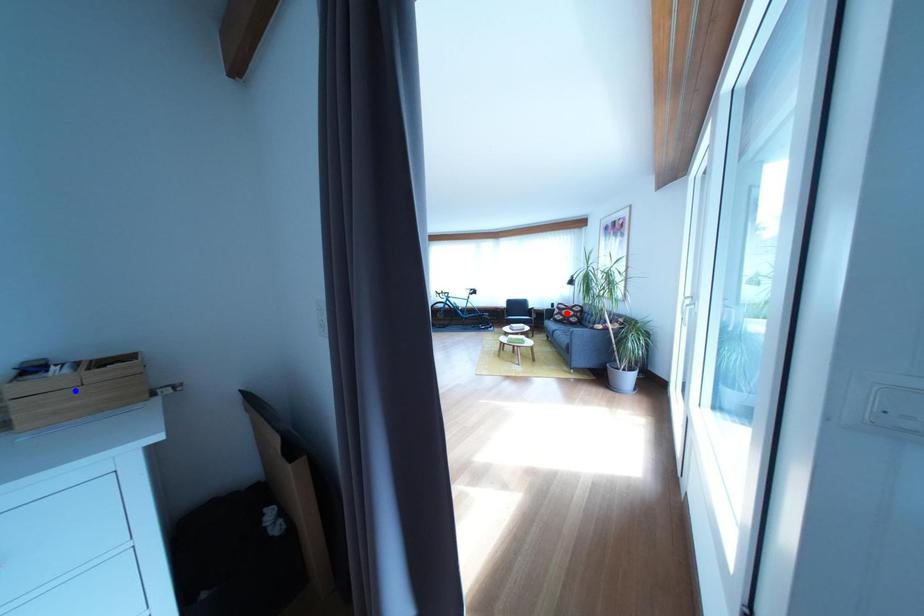
Question: In the image, two points are highlighted. Which point is nearer to the camera? Reply with the corresponding letter.

Choices:
 (A) blue point
 (B) red point

Answer: (A)